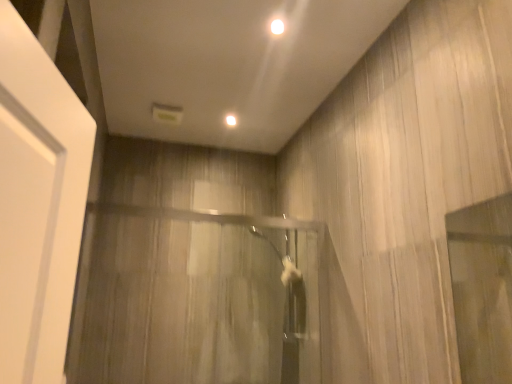
Question: Is point (260, 231) positioned closer to the camera than point (272, 23)?

Choices:
 (A) farther
 (B) closer

Answer: (A)

Question: From a real-world perspective, is clear glass shower door at center positioned above or below white glossy light at upper center, which is the 1th lighting in front-to-back order?

Choices:
 (A) below
 (B) above

Answer: (A)

Question: Which of these objects is positioned farthest from the white glossy light at upper center, marked as the 2th lighting in a front-to-back arrangement?

Choices:
 (A) clear glass shower door at center
 (B) white glossy light at upper center, which is the 1th lighting in front-to-back order

Answer: (A)

Question: Considering the real-world distances, which object is closest to the white glossy light at upper center, which appears as the first lighting when viewed from the back?

Choices:
 (A) clear glass shower door at center
 (B) white glossy light at upper center, the 1th lighting when ordered from right to left

Answer: (B)